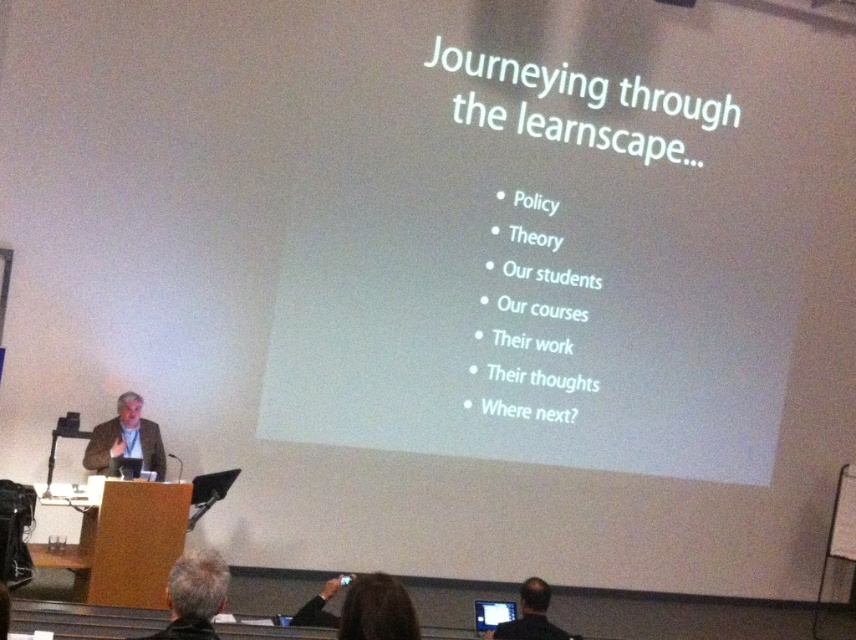
Is beige fabric suit at left smaller than black shirt at lower right?

Incorrect, beige fabric suit at left is not smaller in size than black shirt at lower right.

Does point (123, 406) come behind point (491, 636)?

Yes, point (123, 406) is farther from viewer.

Identify the location of beige fabric suit at left. (125, 440).

Image resolution: width=856 pixels, height=640 pixels. What are the coordinates of `beige fabric suit at left` in the screenshot? It's located at coord(125,440).

Can you confirm if dark brown hair at lower center is smaller than beige fabric suit at left?

Yes, dark brown hair at lower center is smaller than beige fabric suit at left.

Is point (372, 627) positioned after point (99, 442)?

No, it is not.

The height and width of the screenshot is (640, 856). Identify the location of dark brown hair at lower center. (363, 609).

From the picture: Is gray hair at upper center positioned behind black shirt at lower right?

No.

Does gray hair at upper center appear over black shirt at lower right?

Indeed, gray hair at upper center is positioned over black shirt at lower right.

Describe the element at coordinates (194, 595) in the screenshot. I see `gray hair at upper center` at that location.

Locate an element on the screen. This screenshot has height=640, width=856. gray hair at upper center is located at coordinates (194, 595).